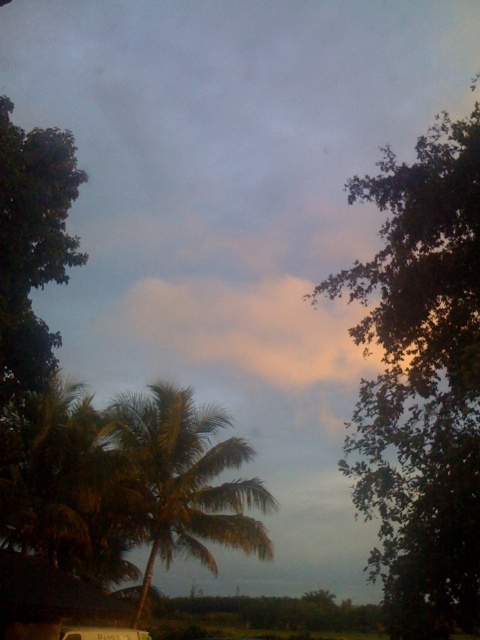
What do you see at coordinates (420, 381) in the screenshot?
I see `green leafy tree at upper right` at bounding box center [420, 381].

Who is positioned more to the right, green leafy tree at upper right or green leafy palm tree at center?

green leafy tree at upper right is more to the right.

Who is more forward, (368, 380) or (147, 577)?

Positioned in front is point (368, 380).

Find the location of `green leafy tree at upper right`. green leafy tree at upper right is located at coordinates [420, 381].

This screenshot has height=640, width=480. What do you see at coordinates (420, 381) in the screenshot? I see `green leafy tree at upper right` at bounding box center [420, 381].

Who is shorter, green leafy tree at upper right or metallic silver van at lower center?

metallic silver van at lower center

What do you see at coordinates (420, 381) in the screenshot? This screenshot has width=480, height=640. I see `green leafy tree at upper right` at bounding box center [420, 381].

What are the coordinates of `green leafy tree at upper right` in the screenshot? It's located at tap(420, 381).

Is green leafy tree at left to the right of metallic silver van at lower center from the viewer's perspective?

In fact, green leafy tree at left is to the left of metallic silver van at lower center.

Does green leafy tree at left have a lesser width compared to metallic silver van at lower center?

Incorrect, green leafy tree at left's width is not less than metallic silver van at lower center's.

The height and width of the screenshot is (640, 480). What are the coordinates of `green leafy tree at left` in the screenshot? It's located at (33, 244).